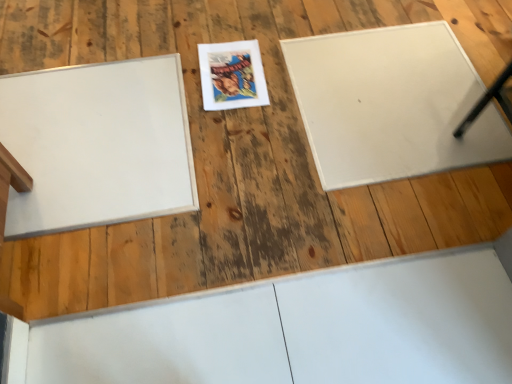
Locate an element on the screen. The width and height of the screenshot is (512, 384). free space above white matte board at left, which is the first bulletin board in left-to-right order (from a real-world perspective) is located at coordinates (92, 137).